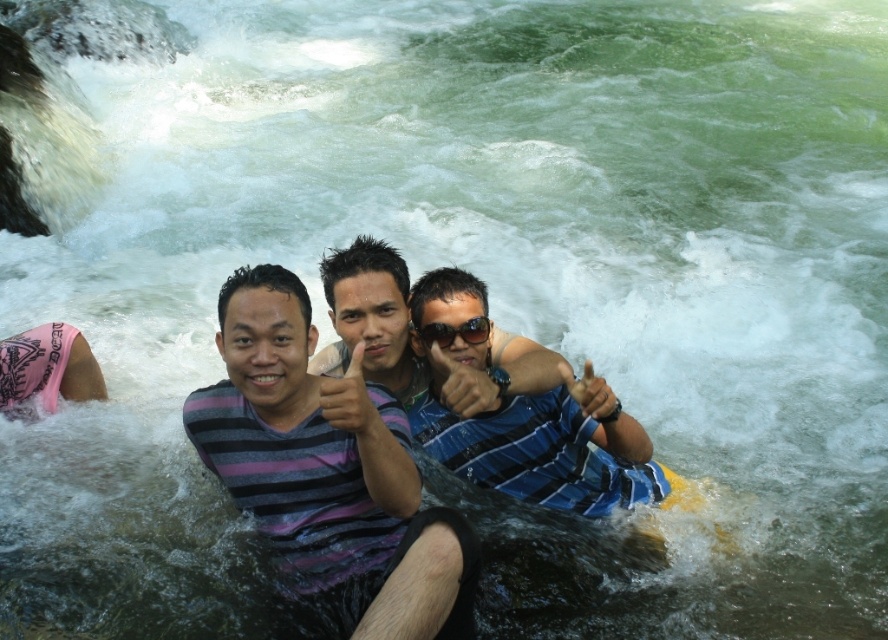
Question: Does striped fabric shirt at center appear under striped fabric man at center?

Choices:
 (A) no
 (B) yes

Answer: (B)

Question: Can you confirm if blue striped shirt at center is wider than sunglasses at center?

Choices:
 (A) no
 (B) yes

Answer: (B)

Question: Which is farther from the blue striped shirt at center?

Choices:
 (A) striped fabric shirt at center
 (B) striped fabric man at center
 (C) sunglasses at center
 (D) yellow rubber at lower center

Answer: (A)

Question: Is striped fabric shirt at center closer to camera compared to sunglasses at center?

Choices:
 (A) no
 (B) yes

Answer: (B)

Question: Which of the following is the closest to the observer?

Choices:
 (A) click(x=518, y=454)
 (B) click(x=511, y=365)

Answer: (B)

Question: Estimate the real-world distances between objects in this image. Which object is farther from the striped fabric shirt at center?

Choices:
 (A) yellow rubber at lower center
 (B) blue striped shirt at center

Answer: (A)